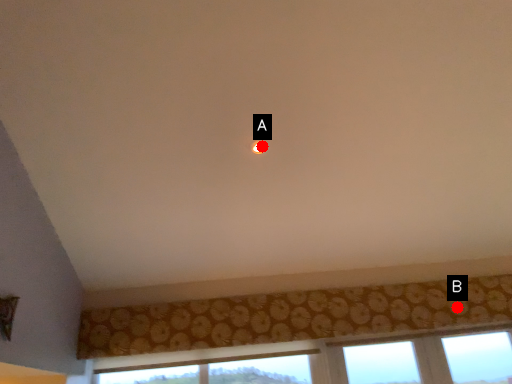
Question: Two points are circled on the image, labeled by A and B beside each circle. Which point is closer to the camera taking this photo?

Choices:
 (A) A is closer
 (B) B is closer

Answer: (A)